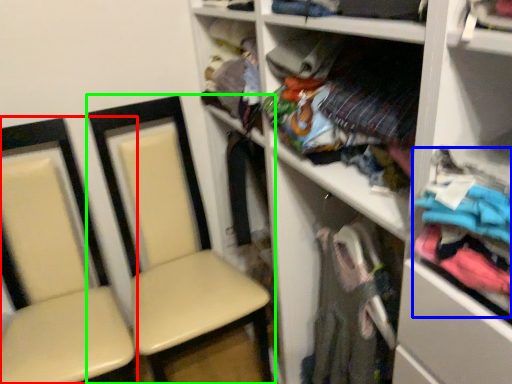
Question: Which object is positioned closest to chair (highlighted by a red box)? Select from clothing (highlighted by a blue box) and chair (highlighted by a green box).

Choices:
 (A) clothing
 (B) chair

Answer: (B)